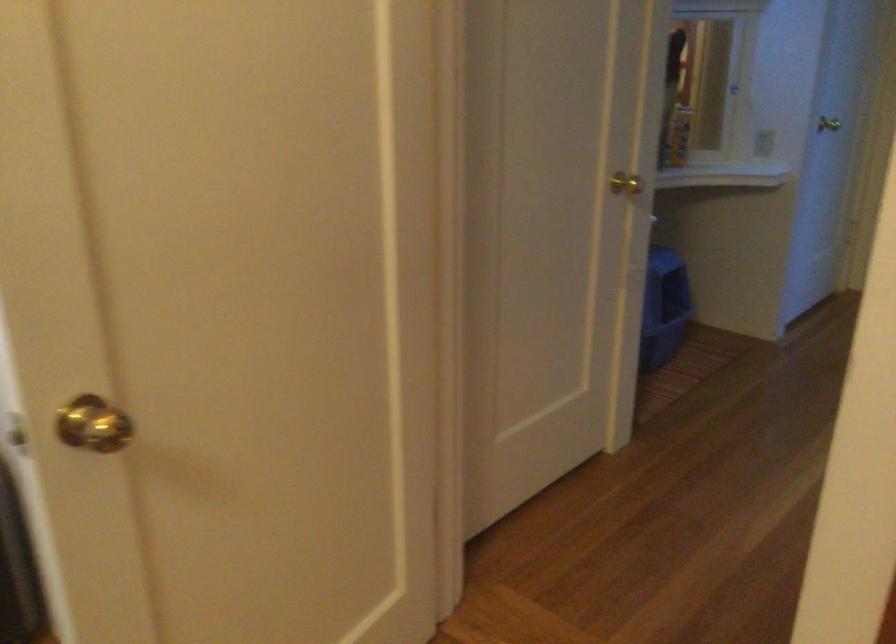
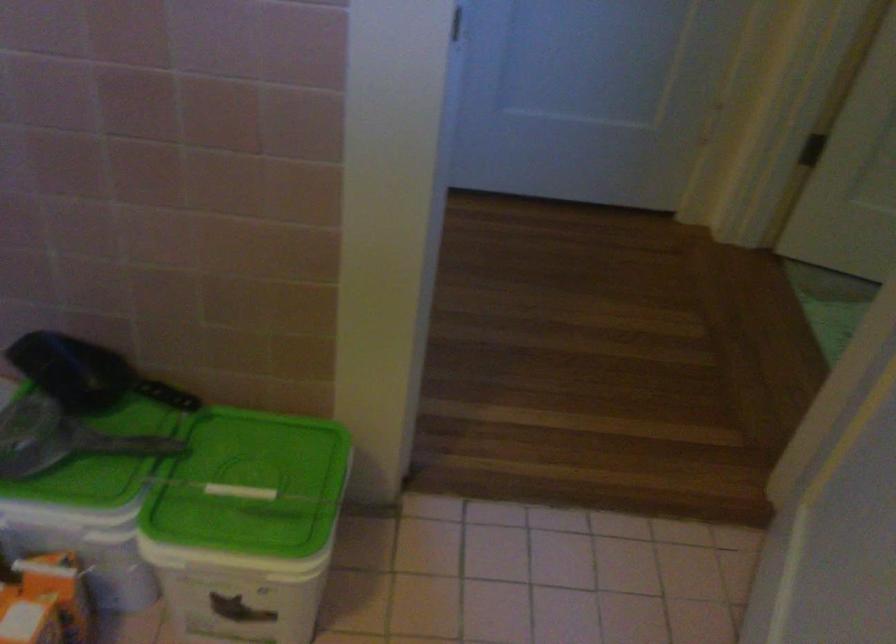
Question: I am providing you with two images of the same scene from different viewpoints. Which of the following objects are not visible in image2?

Choices:
 (A) blue litter box
 (B) blue highlighter
 (C) black scoop handle
 (D) green plastic lid

Answer: (A)